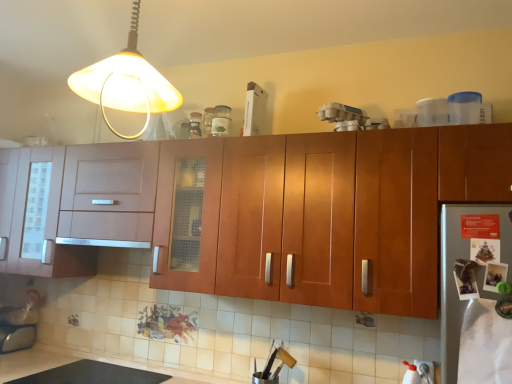
Question: From a real-world perspective, is satin silver exhaust hood at center above or below clear glass jar at upper center, which ranks as the 1th bottle in right-to-left order?

Choices:
 (A) below
 (B) above

Answer: (A)

Question: Relative to clear glass jar at upper center, which ranks as the 1th bottle in right-to-left order, is satin silver exhaust hood at center in front or behind?

Choices:
 (A) front
 (B) behind

Answer: (A)

Question: Which is farther from the clear glass jar at upper center, which ranks as the 1th bottle in right-to-left order?

Choices:
 (A) matte glass bottle at upper center, acting as the 2th bottle starting from the right
 (B) satin silver exhaust hood at center
 (C) matte yellow plastic lampshade at upper left
 (D) wooden cabinet at upper center

Answer: (C)

Question: Which is farther from the matte glass bottle at upper center, which is the first bottle in left-to-right order?

Choices:
 (A) wooden cabinet at upper center
 (B) clear glass jar at upper center, acting as the 2th bottle starting from the left
 (C) matte yellow plastic lampshade at upper left
 (D) satin silver exhaust hood at center

Answer: (C)